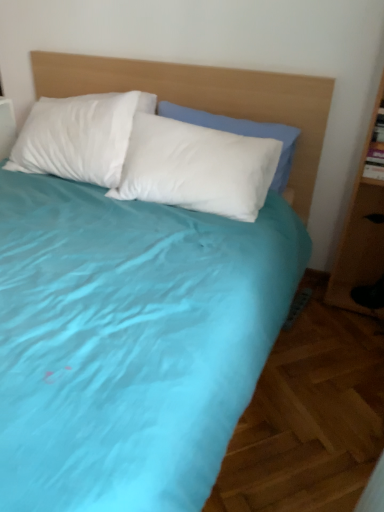
What do you see at coordinates (207, 98) in the screenshot? The image size is (384, 512). I see `wooden headboard at upper center` at bounding box center [207, 98].

In order to face wooden headboard at upper center, should I rotate leftwards or rightwards?

Rotate right and turn 0.705 degrees.

The height and width of the screenshot is (512, 384). Find the location of `wooden headboard at upper center`. wooden headboard at upper center is located at coordinates (207, 98).

What do you see at coordinates (197, 168) in the screenshot?
I see `white soft pillow at center` at bounding box center [197, 168].

Identify the location of white soft pillow at center. (197, 168).

Find the location of a particular element. This screenshot has width=384, height=512. wooden headboard at upper center is located at coordinates (207, 98).

Considering the relative positions of white soft pillow at center and wooden headboard at upper center in the image provided, is white soft pillow at center to the right of wooden headboard at upper center from the viewer's perspective?

Yes, white soft pillow at center is to the right of wooden headboard at upper center.

Considering their positions, is white soft pillow at center located in front of or behind wooden headboard at upper center?

white soft pillow at center is positioned farther from the viewer than wooden headboard at upper center.

Is point (204, 146) positioned behind point (179, 77)?

No, it is in front of (179, 77).

From the image's perspective, is white soft pillow at center above or below wooden headboard at upper center?

From the image's perspective, white soft pillow at center appears above wooden headboard at upper center.

From a real-world perspective, is white soft pillow at center physically located above or below wooden headboard at upper center?

From a real-world perspective, white soft pillow at center is physically above wooden headboard at upper center.

Is white soft pillow at center wider or thinner than wooden headboard at upper center?

Considering their sizes, white soft pillow at center looks slimmer than wooden headboard at upper center.

Considering the sizes of objects white soft pillow at center and wooden headboard at upper center in the image provided, who is shorter, white soft pillow at center or wooden headboard at upper center?

white soft pillow at center is shorter.

Which of these two, white soft pillow at center or wooden headboard at upper center, is bigger?

With larger size is wooden headboard at upper center.

Is white soft pillow at center inside or outside of wooden headboard at upper center?

white soft pillow at center is spatially positioned inside wooden headboard at upper center.

Are white soft pillow at center and wooden headboard at upper center making contact?

No, white soft pillow at center is not with wooden headboard at upper center.

Could you tell me if white soft pillow at center is facing wooden headboard at upper center?

Yes, white soft pillow at center is turned towards wooden headboard at upper center.

Identify the location of headboard that is under the white soft pillow at center (from a real-world perspective). (207, 98).

Considering the positions of objects wooden headboard at upper center and white soft pillow at center in the image provided, who is more to the left, wooden headboard at upper center or white soft pillow at center?

Positioned to the left is wooden headboard at upper center.

Based on the photo, considering the relative positions of wooden headboard at upper center and white soft pillow at center in the image provided, is wooden headboard at upper center in front of white soft pillow at center?

Yes, wooden headboard at upper center is closer to the camera.

Which is closer, (147, 85) or (236, 189)?

The point (236, 189) is closer.

From the image's perspective, is wooden headboard at upper center on white soft pillow at center?

No, from the image's perspective, wooden headboard at upper center is not over white soft pillow at center.

From a real-world perspective, is wooden headboard at upper center located higher than white soft pillow at center?

No, from a real-world perspective, wooden headboard at upper center is not over white soft pillow at center

Can you confirm if wooden headboard at upper center is thinner than white soft pillow at center?

No, wooden headboard at upper center is not thinner than white soft pillow at center.

Is wooden headboard at upper center taller or shorter than white soft pillow at center?

Clearly, wooden headboard at upper center is taller compared to white soft pillow at center.

Is wooden headboard at upper center bigger than white soft pillow at center?

Yes.

Is wooden headboard at upper center outside of white soft pillow at center?

That's correct, wooden headboard at upper center is outside of white soft pillow at center.

Is wooden headboard at upper center in contact with white soft pillow at center?

No, wooden headboard at upper center is not with white soft pillow at center.

Is white soft pillow at center at the back of wooden headboard at upper center?

Absolutely, wooden headboard at upper center is directed away from white soft pillow at center.

How different are the orientations of wooden headboard at upper center and white soft pillow at center in degrees?

wooden headboard at upper center and white soft pillow at center are facing 4.31 degrees away from each other.

Identify the location of headboard on the left of white soft pillow at center. (207, 98).

The width and height of the screenshot is (384, 512). In order to click on headboard below the white soft pillow at center (from a real-world perspective) in this screenshot , I will do `click(207, 98)`.

Find the location of a particular element. headboard on the left of the white soft pillow at center is located at coordinates [207, 98].